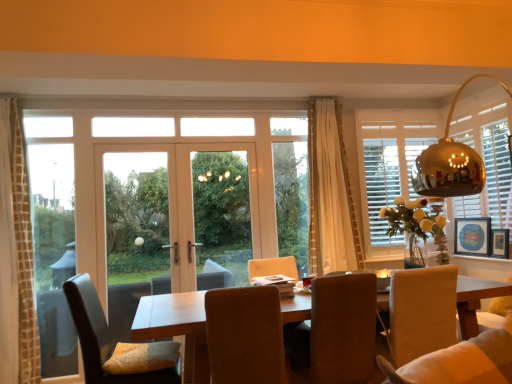
Locate an element on the screen. The height and width of the screenshot is (384, 512). empty space that is ontop of white glass door at center (from a real-world perspective) is located at coordinates (174, 133).